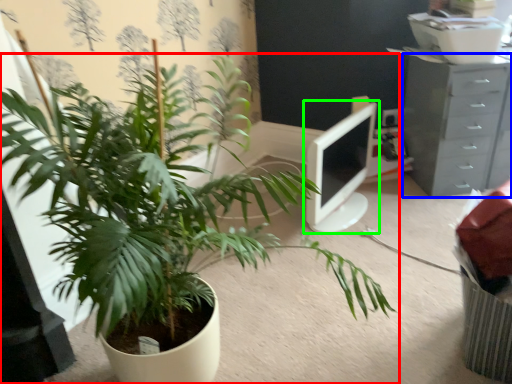
Question: Which is nearer to the houseplant (highlighted by a red box)? chest of drawers (highlighted by a blue box) or computer monitor (highlighted by a green box).

Choices:
 (A) chest of drawers
 (B) computer monitor

Answer: (B)